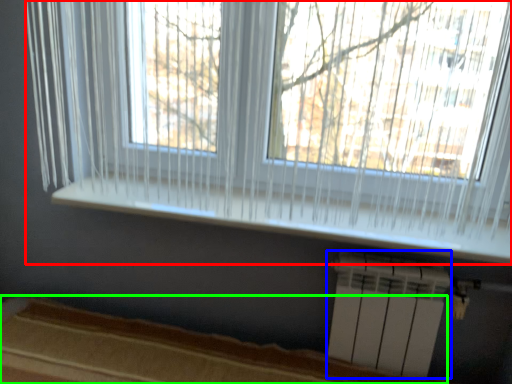
Question: Which is nearer to the window (highlighted by a red box)? air conditioning (highlighted by a blue box) or bed frame (highlighted by a green box).

Choices:
 (A) air conditioning
 (B) bed frame

Answer: (A)